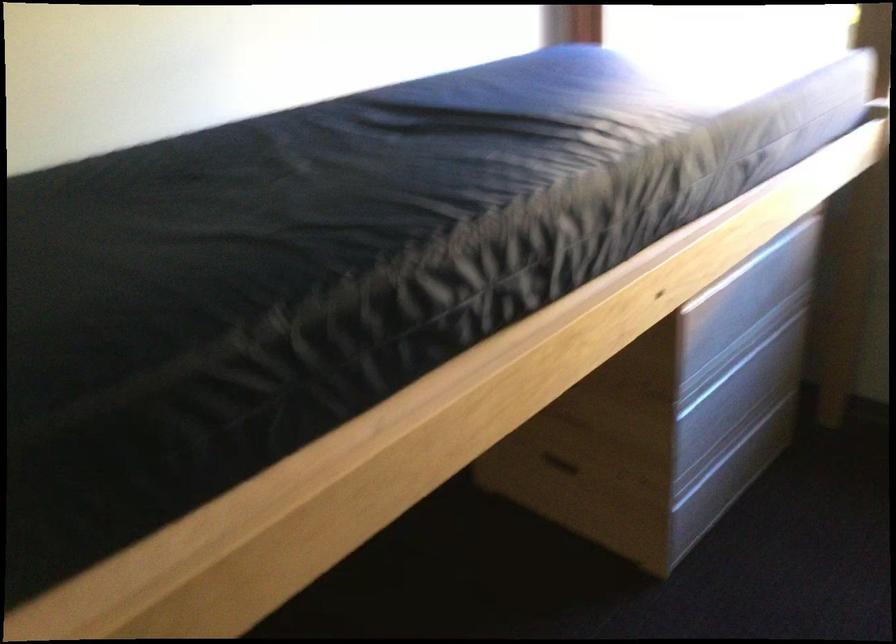
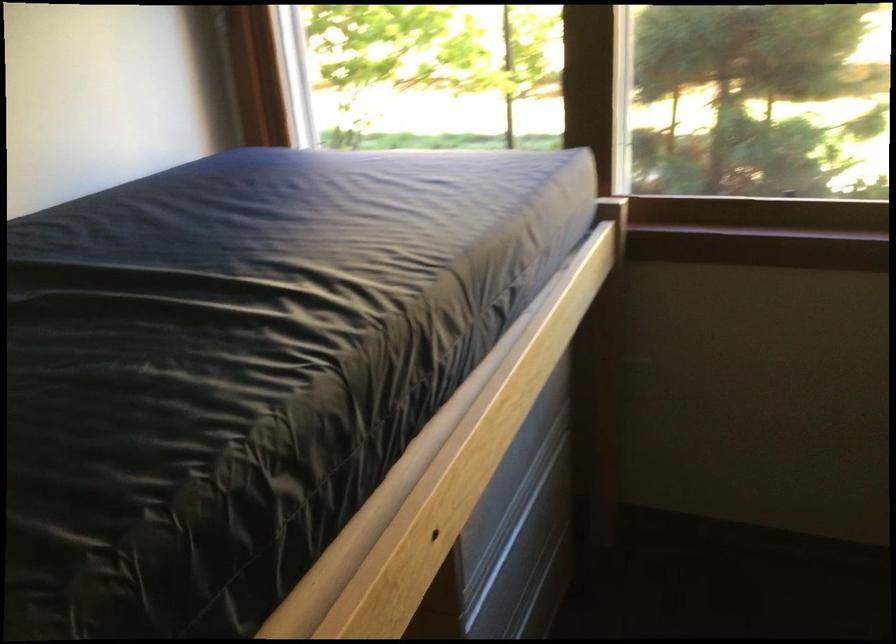
Question: The first image is from the beginning of the video and the second image is from the end. How did the camera likely rotate when shooting the video?

Choices:
 (A) Left
 (B) Right
 (C) Up
 (D) Down

Answer: (B)